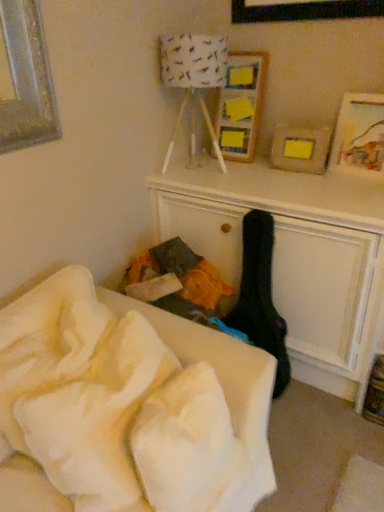
Question: From a real-world perspective, is white soft blanket at lower left physically located above or below wooden painted picture frame at upper right, which is the first picture frame from right to left?

Choices:
 (A) below
 (B) above

Answer: (A)

Question: Is white soft blanket at lower left spatially inside wooden painted picture frame at upper right, the second picture frame viewed from the left, or outside of it?

Choices:
 (A) inside
 (B) outside

Answer: (B)

Question: Which object is the closest to the white soft blanket at lower left?

Choices:
 (A) white paper lampshade at upper center
 (B) black fabric guitar case at center
 (C) wooden painted picture frame at upper right, the second picture frame viewed from the left
 (D) wooden picture frame at upper center, placed as the second picture frame when sorted from right to left

Answer: (B)

Question: Considering the real-world distances, which object is farthest from the black fabric guitar case at center?

Choices:
 (A) white soft blanket at lower left
 (B) wooden picture frame at upper center, which is counted as the first picture frame, starting from the left
 (C) wooden painted picture frame at upper right, the second picture frame viewed from the left
 (D) white paper lampshade at upper center

Answer: (B)